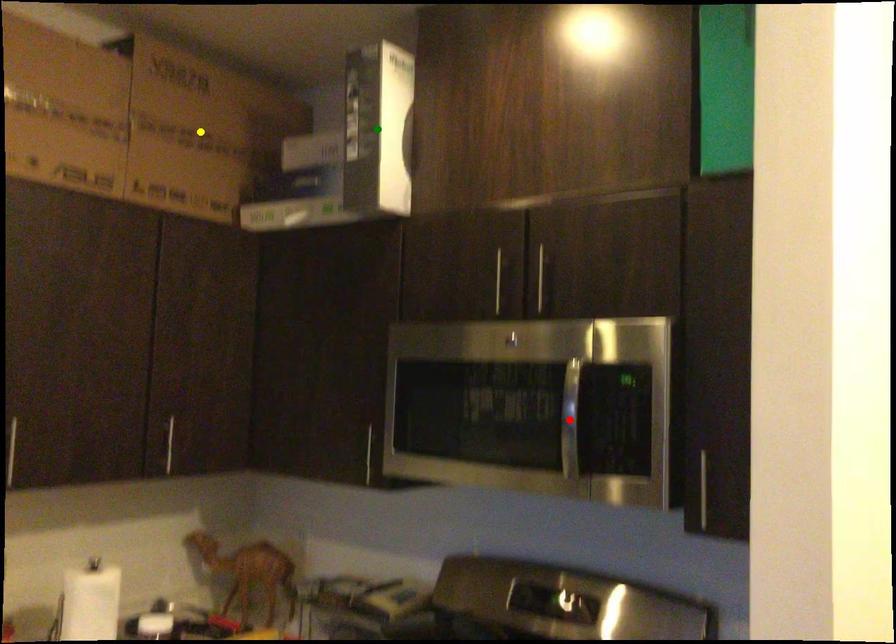
Order these from nearest to farthest:
1. yellow point
2. green point
3. red point

1. red point
2. green point
3. yellow point